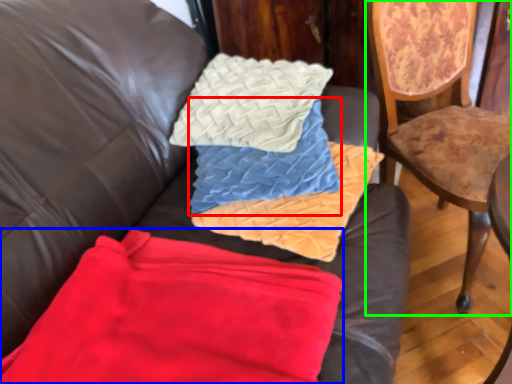
Question: Which object is the farthest from pillow (highlighted by a red box)? Choose among these: material (highlighted by a blue box) or chair (highlighted by a green box).

Choices:
 (A) material
 (B) chair

Answer: (B)